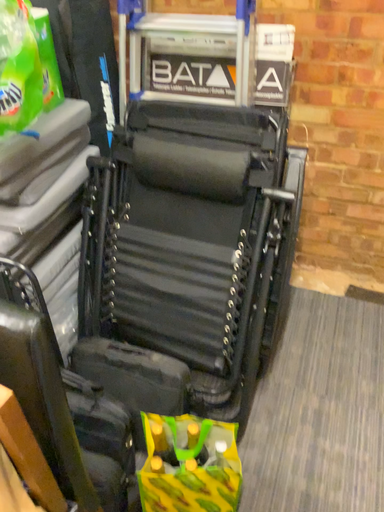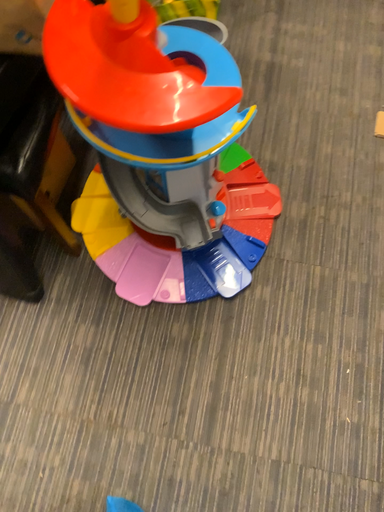
Question: How did the camera likely rotate when shooting the video?

Choices:
 (A) rotated downward
 (B) rotated upward

Answer: (A)